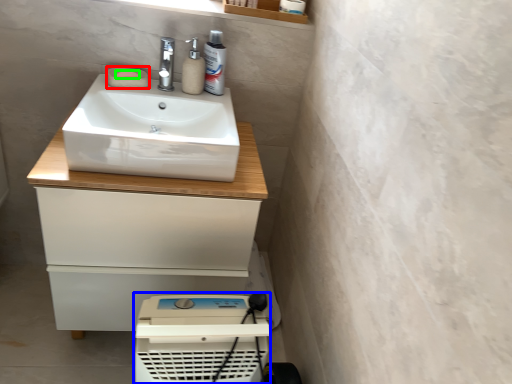
Question: Which object is positioned farthest from soap (highlighted by a red box)? Select from appliance (highlighted by a blue box) and soap (highlighted by a green box).

Choices:
 (A) appliance
 (B) soap

Answer: (A)